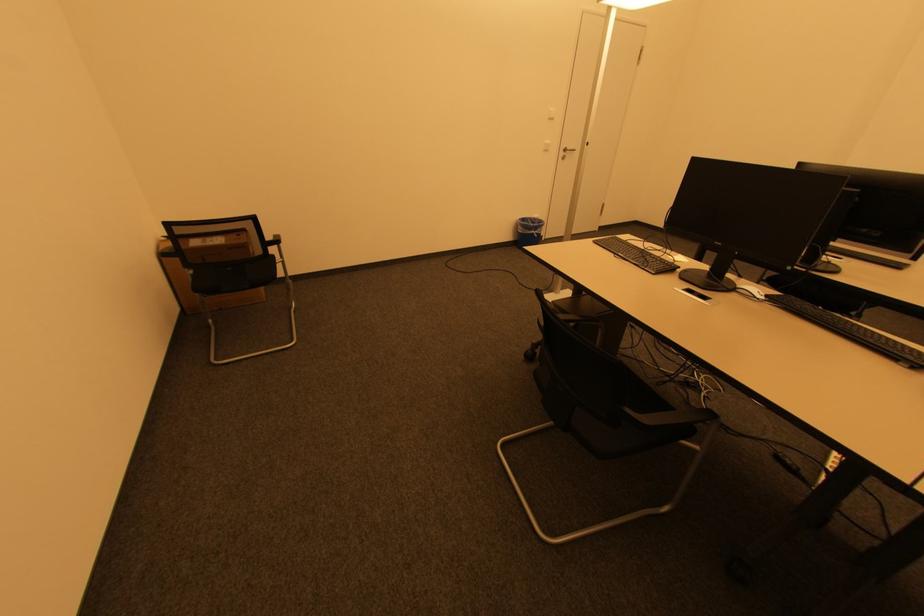
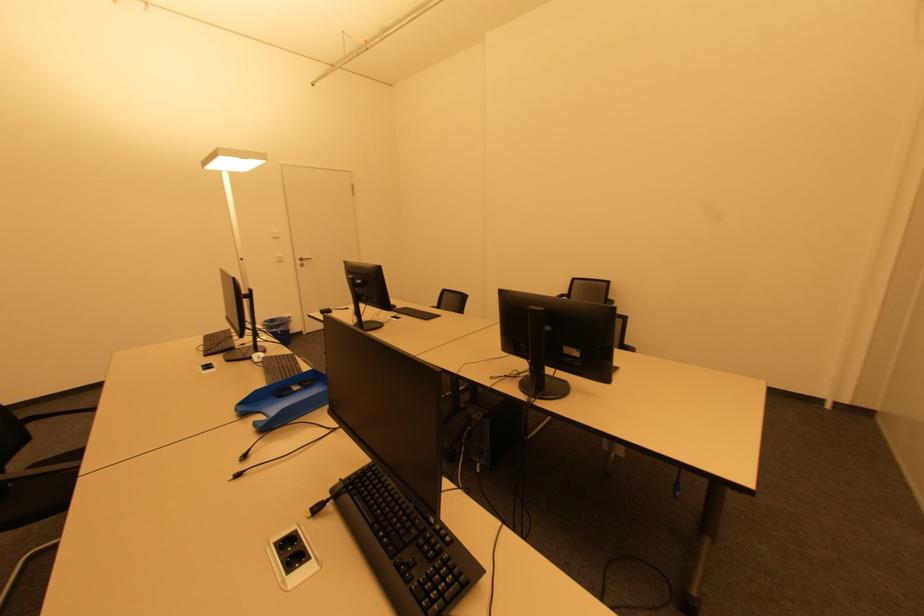
What movement of the cameraman would produce the second image?

The movement direction of the cameraman is right, backward.